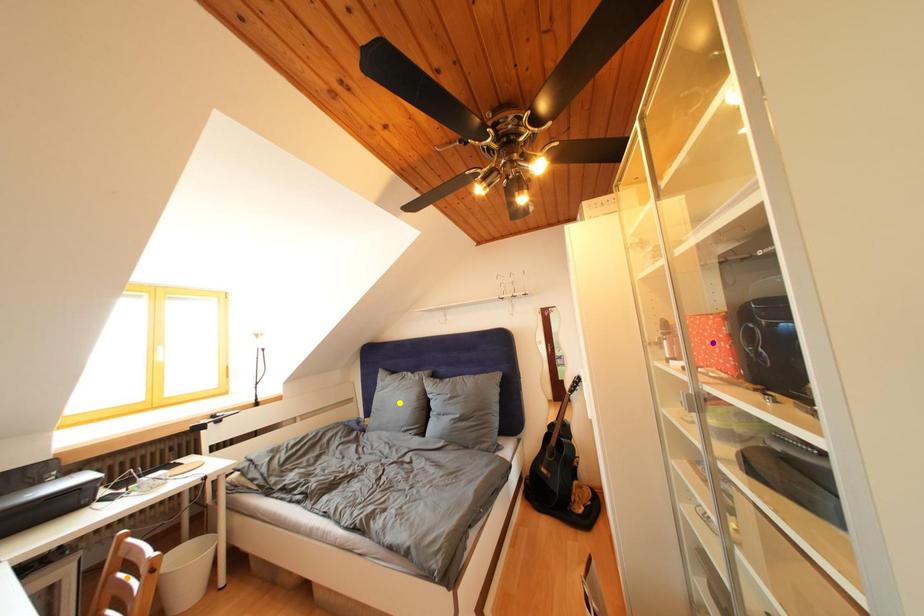
Order these from nearest to farthest:
purple point
yellow point
orange point

orange point < purple point < yellow point